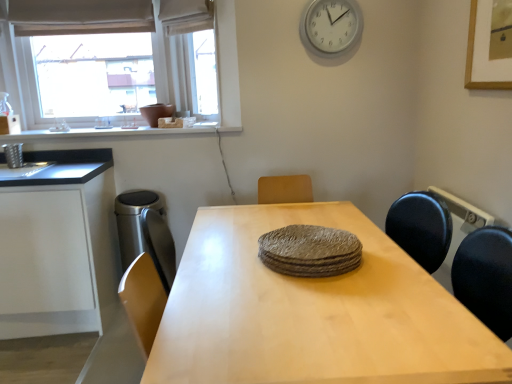
Describe the element at coordinates (19, 77) in the screenshot. I see `matte white window at upper left` at that location.

Where is `matte white window at upper left`? Image resolution: width=512 pixels, height=384 pixels. matte white window at upper left is located at coordinates (19, 77).

Describe the element at coordinates (331, 27) in the screenshot. The width and height of the screenshot is (512, 384). I see `white plastic clock at upper center` at that location.

Where is `white matte cabinet at left`? The height and width of the screenshot is (384, 512). white matte cabinet at left is located at coordinates (59, 246).

The width and height of the screenshot is (512, 384). I want to click on matte white window at upper left, so click(19, 77).

From the image's perspective, which object appears higher, light wood table at center or white matte window sill at upper left?

white matte window sill at upper left, from the image's perspective.

Looking at this image, is light wood table at center taller than white matte window sill at upper left?

Correct, light wood table at center is much taller as white matte window sill at upper left.

Is light wood table at center facing away from white matte window sill at upper left?

No, light wood table at center is not facing the opposite direction of white matte window sill at upper left.

Between point (13, 139) and point (323, 21), which one is positioned in front?

The point (323, 21) is in front.

Is white matte window sill at upper left not within white plastic clock at upper center?

That's correct, white matte window sill at upper left is outside of white plastic clock at upper center.

Is white plastic clock at upper center at the back of white matte window sill at upper left?

No, white matte window sill at upper left is not facing the opposite direction of white plastic clock at upper center.

Where is `clock above the white matte window sill at upper left (from the image's perspective)`? The image size is (512, 384). clock above the white matte window sill at upper left (from the image's perspective) is located at coordinates (331, 27).

Is textured gray plates at center located within white matte cabinet at left?

Definitely not — textured gray plates at center is not inside white matte cabinet at left.

In the scene shown: Which is further, (x=45, y=305) or (x=285, y=260)?

Positioned behind is point (x=45, y=305).

Is white matte cabinet at left turned away from textured gray plates at center?

That's not correct — white matte cabinet at left is not looking away from textured gray plates at center.

Does matte white window at upper left have a greater width compared to satin silver trash can at left?

No.

Which of these two, matte white window at upper left or satin silver trash can at left, is smaller?

With smaller size is satin silver trash can at left.

Is matte white window at upper left directly adjacent to satin silver trash can at left?

No, matte white window at upper left is not next to satin silver trash can at left.

Between matte white window at upper left and satin silver trash can at left, which one is positioned in front?

satin silver trash can at left is closer to the camera.

Where is `clock above the white matte cabinet at left (from a real-world perspective)`? This screenshot has height=384, width=512. clock above the white matte cabinet at left (from a real-world perspective) is located at coordinates (331, 27).

Is white matte cabinet at left positioned with its back to white plastic clock at upper center?

No, white matte cabinet at left is not facing away from white plastic clock at upper center.

How distant is white matte cabinet at left from white plastic clock at upper center?

white matte cabinet at left and white plastic clock at upper center are 1.85 meters apart from each other.

Is the position of white matte cabinet at left more distant than that of white plastic clock at upper center?

No, white matte cabinet at left is closer to the viewer.

Is matte white window at upper left taller or shorter than white matte cabinet at left?

matte white window at upper left is taller than white matte cabinet at left.

Considering the relative positions of matte white window at upper left and white matte cabinet at left in the image provided, is matte white window at upper left to the left of white matte cabinet at left from the viewer's perspective?

No, matte white window at upper left is not to the left of white matte cabinet at left.

Is matte white window at upper left located outside white matte cabinet at left?

matte white window at upper left lies outside white matte cabinet at left's area.

Could you tell me if matte white window at upper left is facing white matte cabinet at left?

No, matte white window at upper left is not turned towards white matte cabinet at left.

Considering the relative sizes of white matte window sill at upper left and matte white window at upper left in the image provided, is white matte window sill at upper left thinner than matte white window at upper left?

In fact, white matte window sill at upper left might be wider than matte white window at upper left.

Is the depth of white matte window sill at upper left greater than that of matte white window at upper left?

No.

Which is behind, point (206, 129) or point (10, 60)?

The point (10, 60) is more distant.

Does white matte window sill at upper left appear on the right side of matte white window at upper left?

Indeed, white matte window sill at upper left is positioned on the right side of matte white window at upper left.

Find the location of `window sill behind the light wood table at center`. window sill behind the light wood table at center is located at coordinates (110, 132).

This screenshot has width=512, height=384. I want to click on clock above the white matte window sill at upper left (from the image's perspective), so click(331, 27).

Estimate the real-world distances between objects in this image. Which object is further from satin silver trash can at left, white matte cabinet at left or white matte window sill at upper left?

The object further to satin silver trash can at left is white matte window sill at upper left.

Based on their spatial positions, is light wood table at center or white plastic clock at upper center further from textured gray plates at center?

white plastic clock at upper center lies further to textured gray plates at center than the other object.

From the picture: Based on their spatial positions, is white plastic clock at upper center or satin silver trash can at left closer to white matte cabinet at left?

Based on the image, satin silver trash can at left appears to be nearer to white matte cabinet at left.

Based on their spatial positions, is white matte window sill at upper left or white plastic clock at upper center closer to white matte cabinet at left?

white matte window sill at upper left.

Considering their positions, is white matte window sill at upper left positioned further to matte white window at upper left than light wood table at center?

The object further to matte white window at upper left is light wood table at center.

Looking at the image, which one is located further to white matte cabinet at left, matte white window at upper left or light wood table at center?

matte white window at upper left is positioned further to the anchor white matte cabinet at left.

Which object lies nearer to the anchor point light wood table at center, matte white window at upper left or white matte cabinet at left?

white matte cabinet at left.

Which object lies further to the anchor point white plastic clock at upper center, satin silver trash can at left or white matte window sill at upper left?

Based on the image, satin silver trash can at left appears to be further to white plastic clock at upper center.

I want to click on appliance between white matte window sill at upper left and white matte cabinet at left vertically, so click(145, 232).

You are a GUI agent. You are given a task and a screenshot of the screen. Output one action in this format:
    pyautogui.click(x=<x>, y=<y>)
    Task: Click on the window sill between white matte cabinet at left and textured gray plates at center
    
    Given the screenshot: What is the action you would take?
    pyautogui.click(x=110, y=132)

This screenshot has height=384, width=512. I want to click on appliance positioned between light wood table at center and white matte window sill at upper left from near to far, so click(x=145, y=232).

Identify the location of window sill situated between white matte cabinet at left and white plastic clock at upper center from left to right. The image size is (512, 384). (110, 132).